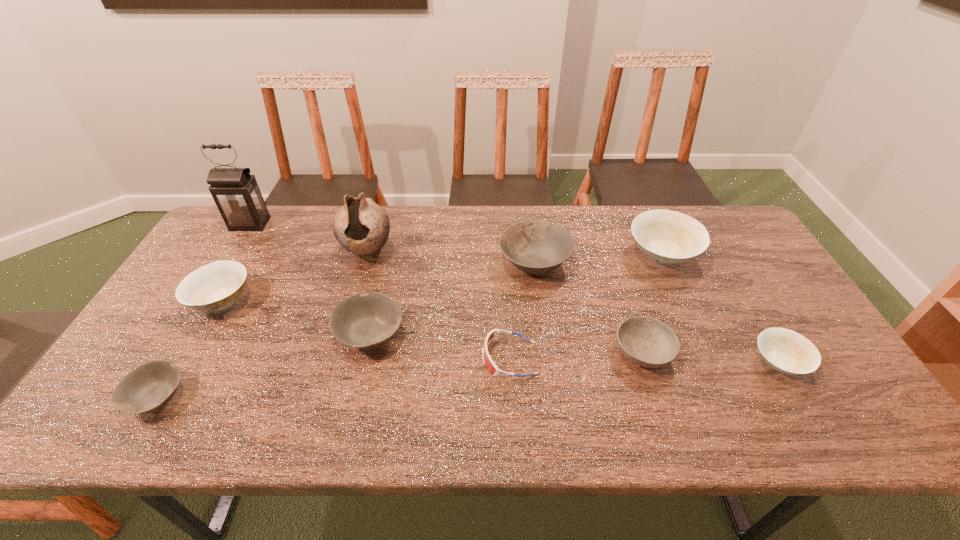
Find the location of `object located at the near left corner`. object located at the near left corner is located at coordinates (146, 388).

In the image, there is a desktop. Where is `vacant region at the far edge`? The width and height of the screenshot is (960, 540). vacant region at the far edge is located at coordinates (580, 239).

In the image, there is a desktop. At what (x,y) coordinates should I click in order to perform the action: click on free region at the near edge. Please return your answer as a coordinate pair (x, y). Image resolution: width=960 pixels, height=540 pixels. Looking at the image, I should click on (767, 402).

You are a GUI agent. You are given a task and a screenshot of the screen. Output one action in this format:
    pyautogui.click(x=<x>, y=<y>)
    Task: Click on the free spot at the left edge of the desktop
    This screenshot has height=540, width=960.
    Given the screenshot: What is the action you would take?
    pyautogui.click(x=159, y=346)

Where is `vacant space at the right edge`? The width and height of the screenshot is (960, 540). vacant space at the right edge is located at coordinates (801, 310).

Locate an element on the screen. vacant space at the near right corner is located at coordinates (871, 413).

Identify the location of free space between the smallest gray bowl and the smallest beige bowl. (468, 380).

Image resolution: width=960 pixels, height=540 pixels. I want to click on empty location between the tallest object and the second biggest beige bowl, so click(236, 262).

This screenshot has height=540, width=960. I want to click on vacant area that lies between the pottery and the nearest gray bowl, so click(262, 325).

In order to click on empty location between the biggest beige bowl and the gray lantern in this screenshot , I will do `click(456, 239)`.